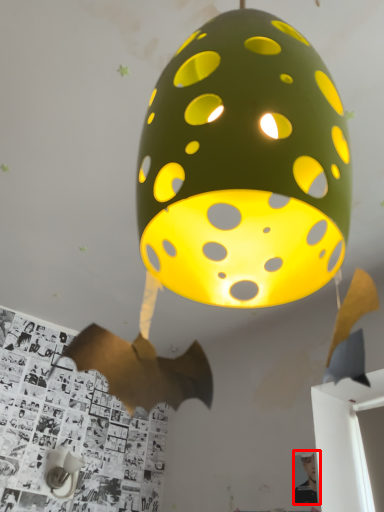
Question: Where is person (annotated by the red box) located in relation to table lamp in the image?

Choices:
 (A) right
 (B) left

Answer: (A)